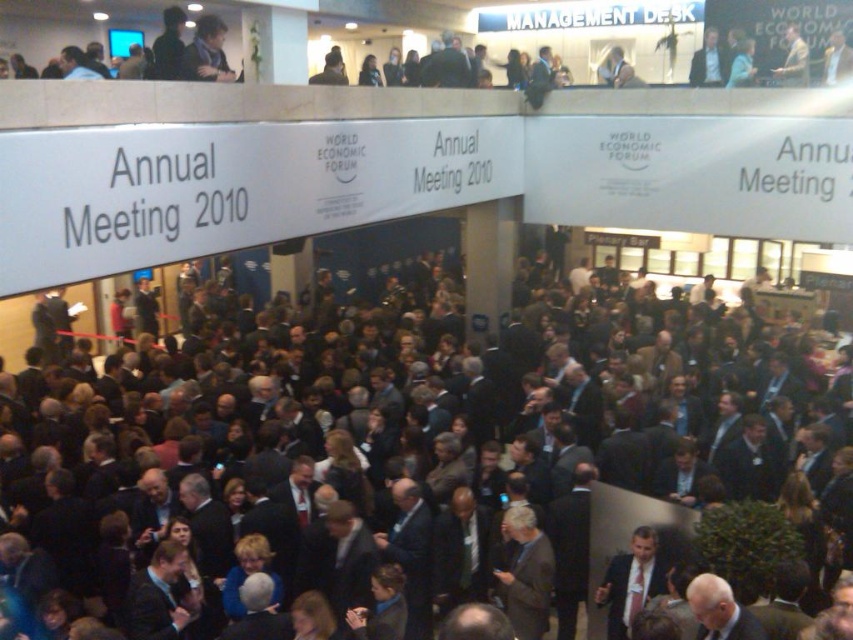
Which is below, dark suit crowd at center or light beige suit at upper right?

dark suit crowd at center

In the scene shown: Measure the distance from dark suit crowd at center to light beige suit at upper right.

They are 9.80 meters apart.

The height and width of the screenshot is (640, 853). What are the coordinates of `dark suit crowd at center` in the screenshot? It's located at (436, 460).

Does point (419, 515) lie behind point (210, 60)?

That is False.

This screenshot has height=640, width=853. What are the coordinates of `dark suit crowd at center` in the screenshot? It's located at (436, 460).

Is dark gray suit at upper center above light beige suit at upper right?

Incorrect, dark gray suit at upper center is not positioned above light beige suit at upper right.

Measure the distance from dark gray suit at upper center to light beige suit at upper right.

12.04 meters

This screenshot has width=853, height=640. I want to click on dark gray suit at upper center, so click(206, 52).